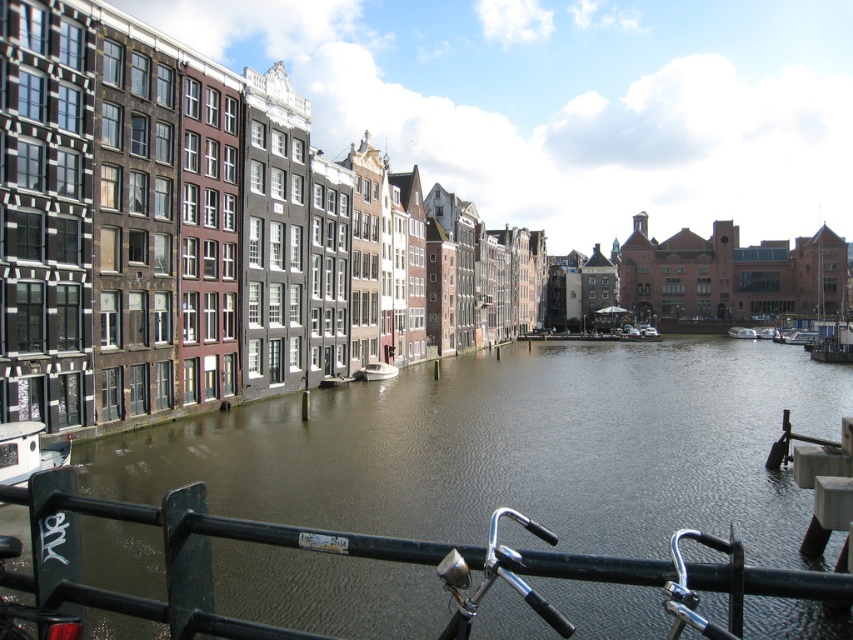
Question: Among these objects, which one is farthest from the camera?

Choices:
 (A) brown water at center
 (B) white glossy boat at center

Answer: (B)

Question: Which object appears closest to the camera in this image?

Choices:
 (A) white glossy boat at center
 (B) white plastic boat at center
 (C) brown water at center

Answer: (C)

Question: Is brown water at center below white glossy boat at center?

Choices:
 (A) yes
 (B) no

Answer: (A)

Question: Can you confirm if brown water at center is positioned to the left of white glossy boat at center?

Choices:
 (A) yes
 (B) no

Answer: (B)

Question: Which object is farther from the camera taking this photo?

Choices:
 (A) white plastic boat at center
 (B) white glossy boat at center

Answer: (A)

Question: Can you confirm if brown water at center is positioned to the right of white glossy boat at center?

Choices:
 (A) yes
 (B) no

Answer: (A)